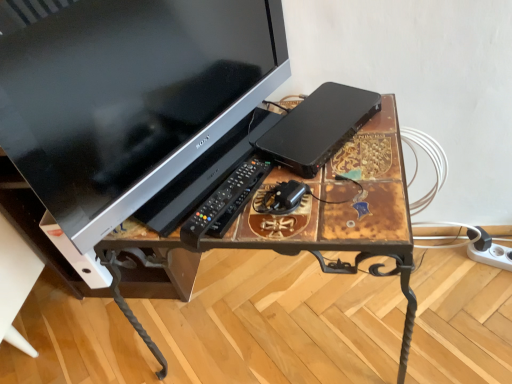
Identify the location of blank space above rustic wood desk at center (from a real-world perspective). (289, 174).